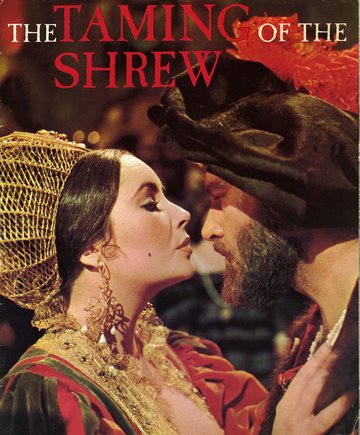
Where is `robe`? The height and width of the screenshot is (435, 360). robe is located at coordinates (221, 378).